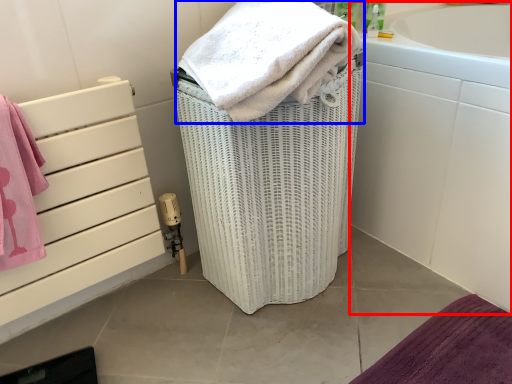
Question: Among these objects, which one is farthest to the camera, bath (highlighted by a red box) or towel (highlighted by a blue box)?

Choices:
 (A) bath
 (B) towel

Answer: (A)